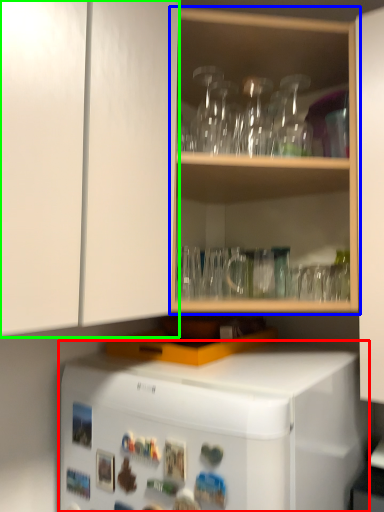
Question: Which object is positioned closest to refrigerator (highlighted by a red box)? Select from shelf (highlighted by a blue box) and cabinetry (highlighted by a green box).

Choices:
 (A) shelf
 (B) cabinetry

Answer: (B)